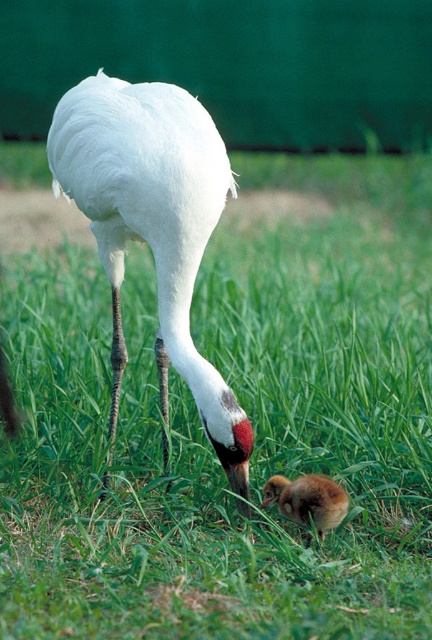
Does white feathered crane at center have a smaller size compared to brown fluffy chick at lower center?

Actually, white feathered crane at center might be larger than brown fluffy chick at lower center.

Between point (114, 419) and point (324, 513), which one is positioned behind?

Positioned behind is point (114, 419).

Measure the distance between point (127, 228) and camera.

Point (127, 228) is 9.33 feet away from camera.

Identify the location of white feathered crane at center. (152, 225).